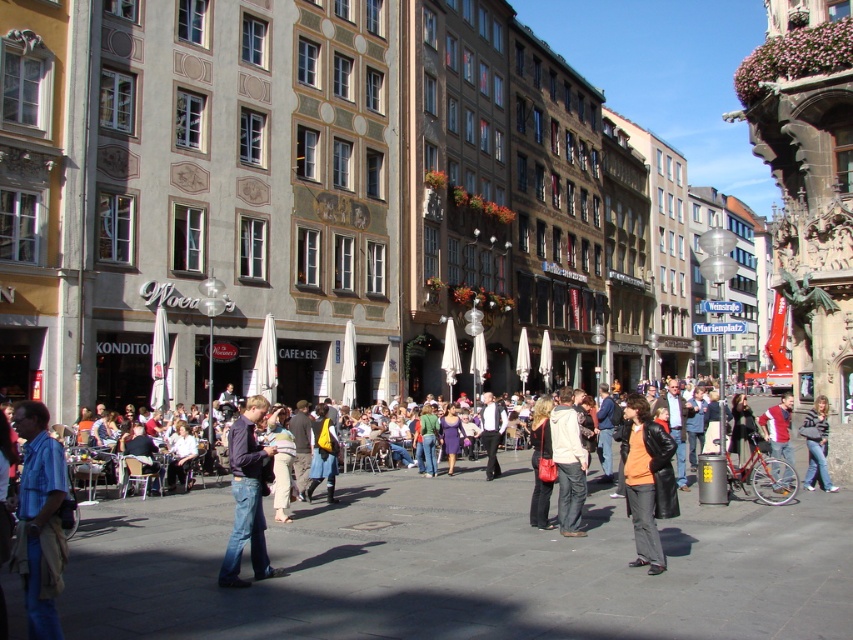
Question: Which point is farther to the camera?

Choices:
 (A) light beige jacket at center
 (B) orange matte jacket at center
 (C) red jacket at center

Answer: (C)

Question: Which point is farther from the camera taking this photo?

Choices:
 (A) (773, 451)
 (B) (560, 490)

Answer: (A)

Question: Is denim jeans at center smaller than white shirt at center?

Choices:
 (A) yes
 (B) no

Answer: (B)

Question: Among these points, which one is nearest to the camera?

Choices:
 (A) (317, 483)
 (B) (805, 422)
 (C) (642, 540)

Answer: (C)

Question: Can you confirm if orange matte jacket at center is positioned to the right of red jacket at center?

Choices:
 (A) no
 (B) yes

Answer: (A)

Question: Does orange matte jacket at center appear on the right side of yellow backpack at center?

Choices:
 (A) no
 (B) yes

Answer: (B)